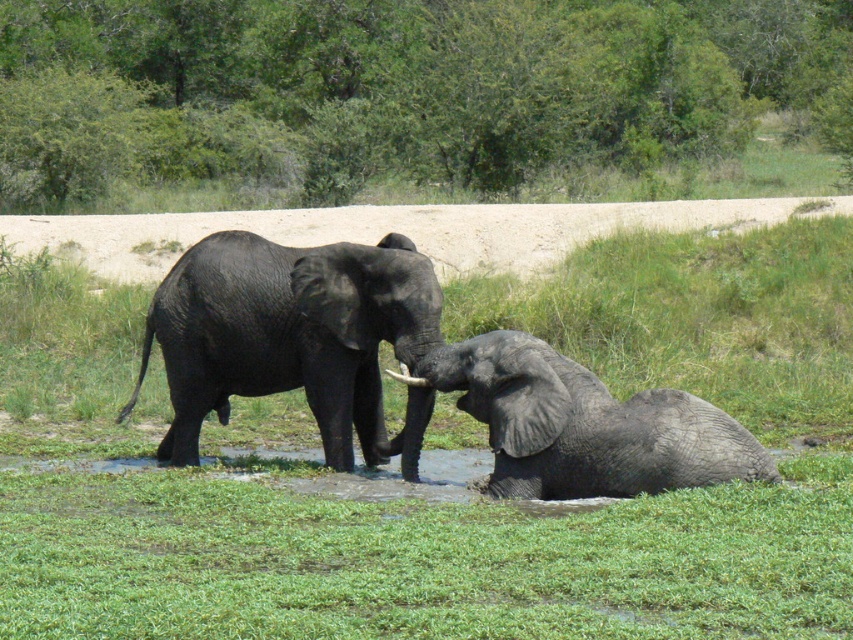
You are a wildlife photographer standing at the edge of the savanna. You want to capture a photo of both the green grassy at center and the shiny black elephant at center in the same frame. Given that your camera has a 5 feet focal length, will you be able to include both objects in your shot?

The distance between the green grassy at center and the shiny black elephant at center is 5.95 feet, which is slightly more than the 5 feet focal length of the camera. Therefore, you might need to adjust your position or use a wider lens to ensure both objects are in the frame.

You are a wildlife photographer aiming to capture both the gray matte elephant at lower right and the white ivory tusk at upper center in a single frame. Given their sizes, which object will occupy more space in your photo?

The gray matte elephant at lower right will occupy more space in the photo because it is bigger than the white ivory tusk at upper center.

You are a wildlife photographer aiming to capture a clear photo of both the shiny black elephant at center and the white ivory tusk at upper center. Based on their positions, will the elephant block the view of the tusk in your shot?

The shiny black elephant at center is positioned over white ivory tusk at upper center, so it will block the view of the tusk in the photo.